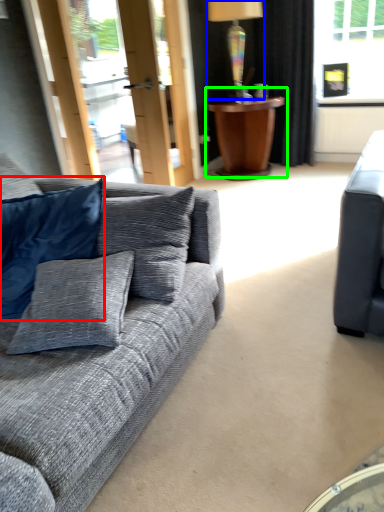
Question: Which object is the farthest from pillow (highlighted by a red box)? Choose among these: lamp (highlighted by a blue box) or table (highlighted by a green box).

Choices:
 (A) lamp
 (B) table

Answer: (A)